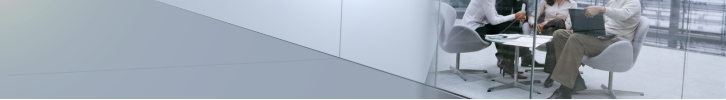
You are a GUI agent. You are given a task and a screenshot of the screen. Output one action in this format:
    pyautogui.click(x=<x>, y=<y>)
    Task: Click on the glass partitions
    The image size is (726, 100).
    Given the screenshot: What is the action you would take?
    pyautogui.click(x=399, y=41), pyautogui.click(x=491, y=47), pyautogui.click(x=616, y=56), pyautogui.click(x=709, y=55)